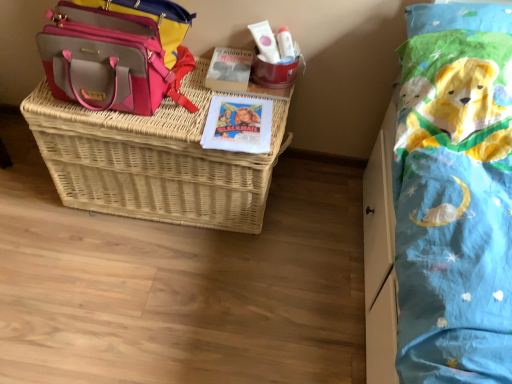
Find the location of a particular element. free point to the right of woven wicker basket at center is located at coordinates tap(316, 235).